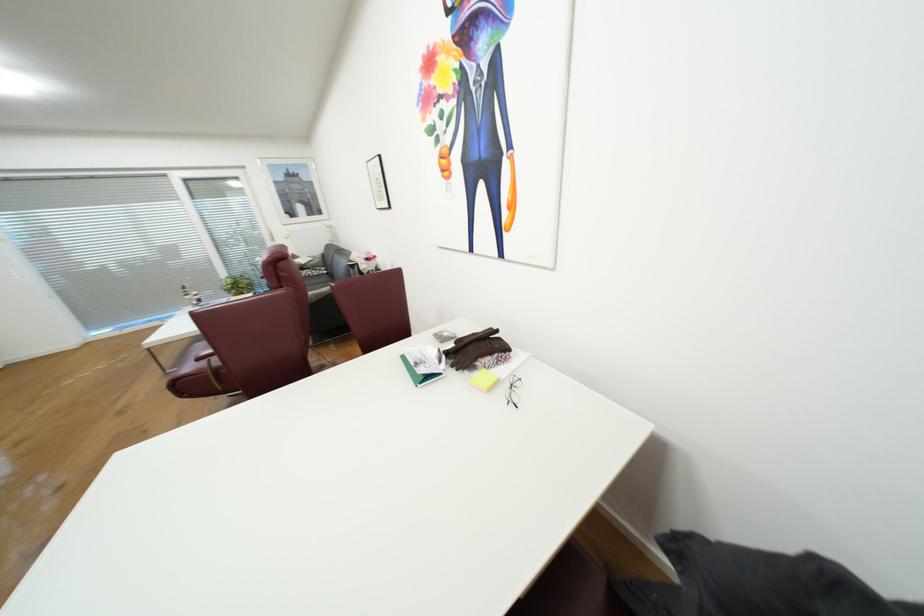
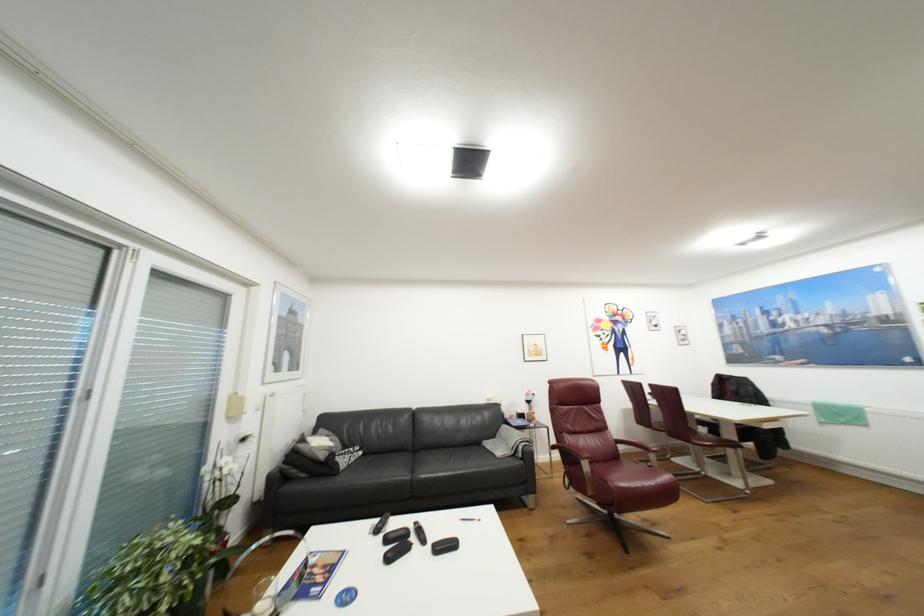
Question: I am providing you with two images of the same scene from different viewpoints. Please identify which objects are invisible in image2.

Choices:
 (A) black sofa sitting surface
 (B) green notebook
 (C) blue pen cap
 (D) red chair sitting surface

Answer: (B)